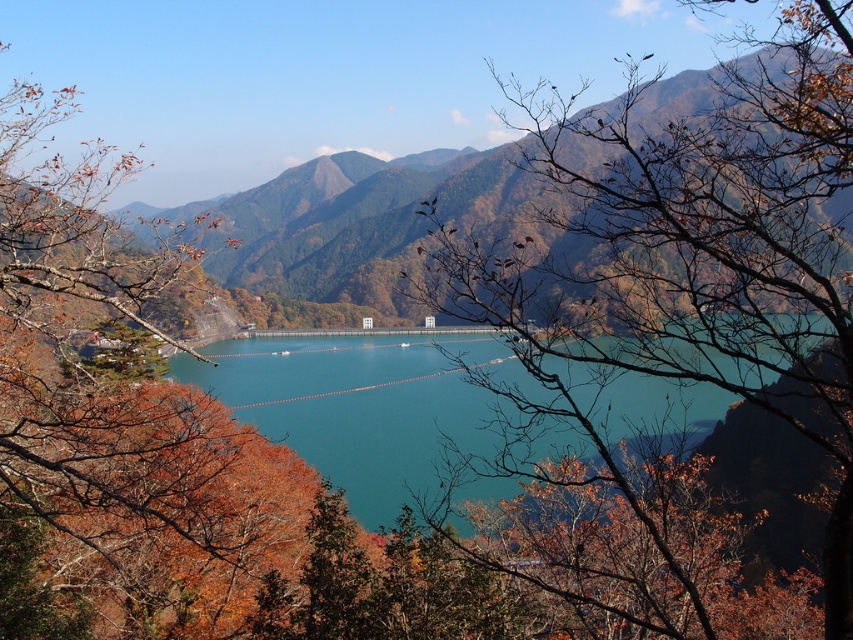
You are standing at the lakeside and want to take a photo of the teal glossy water at center and the green grassy mountain at center. Which one will appear larger in your camera view?

The teal glossy water at center will appear larger in your camera view because it is closer to the viewer than the green grassy mountain at center.

You are an artist trying to paint the scene. You want to ensure the brown leafy branches at center and the teal glossy water at center are proportionally accurate. Which object should you draw larger?

The brown leafy branches at center should be drawn larger than the teal glossy water at center because the description states that the brown leafy branches at center is larger in size than the teal glossy water at center.

You are a hiker standing at the edge of the reservoir looking towards the mountains. You see the brown leafy branches at center and the green grassy mountain at center. Which object is closer to you?

The brown leafy branches at center are closer to you because they are located below the green grassy mountain at center, which places them in the foreground.